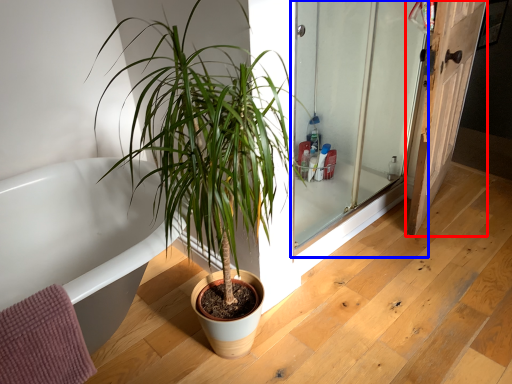
Question: Which object appears farthest to the camera in this image, door (highlighted by a red box) or screen door (highlighted by a blue box)?

Choices:
 (A) door
 (B) screen door

Answer: (A)